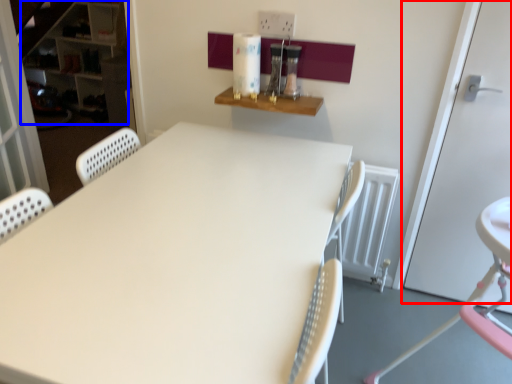
Question: Which object is further to the camera taking this photo, door (highlighted by a red box) or bookshelf (highlighted by a blue box)?

Choices:
 (A) door
 (B) bookshelf

Answer: (B)